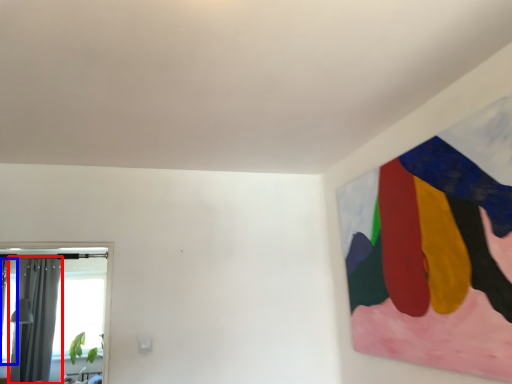
Question: Which of the following is the farthest to the observer, curtain (highlighted by a red box) or window (highlighted by a blue box)?

Choices:
 (A) curtain
 (B) window

Answer: (A)